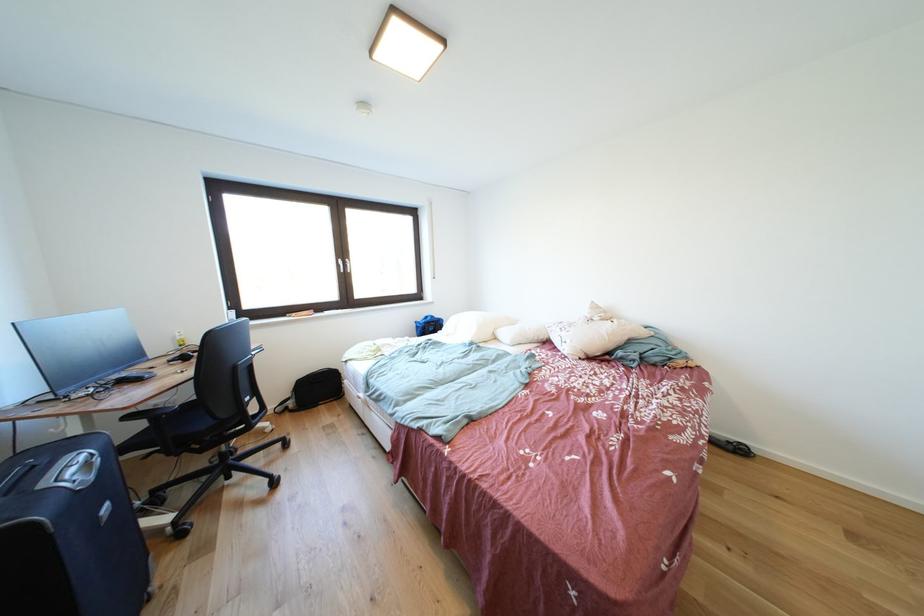
Identify the location of chair sitting surface. (202, 424).